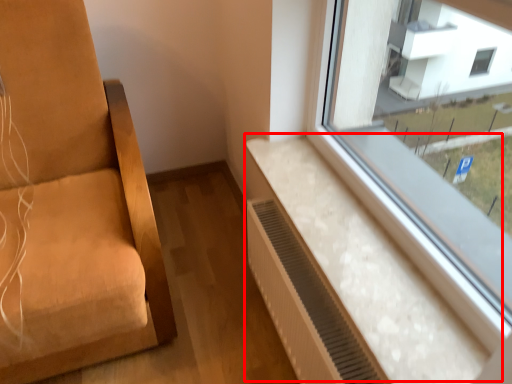
Question: In this image, where is window sill (annotated by the red box) located relative to air conditioner?

Choices:
 (A) right
 (B) left

Answer: (A)